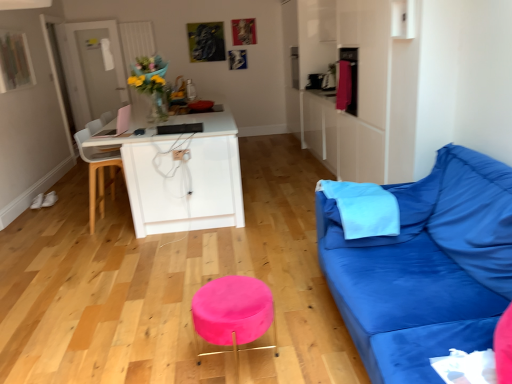
Question: Is the depth of white plastic chair at left less than that of light blue fabric pillow at right, arranged as the 1th pillow when viewed from the left?

Choices:
 (A) yes
 (B) no

Answer: (B)

Question: Can you confirm if white plastic chair at left is shorter than light blue fabric pillow at right, arranged as the 1th pillow when viewed from the left?

Choices:
 (A) no
 (B) yes

Answer: (A)

Question: Would you consider white plastic chair at left to be distant from light blue fabric pillow at right, the 2th pillow positioned from the right?

Choices:
 (A) no
 (B) yes

Answer: (B)

Question: Is white plastic chair at left facing away from light blue fabric pillow at right, the 2th pillow positioned from the right?

Choices:
 (A) no
 (B) yes

Answer: (A)

Question: Is white plastic chair at left directly adjacent to light blue fabric pillow at right, the 2th pillow positioned from the right?

Choices:
 (A) yes
 (B) no

Answer: (B)

Question: Is point (96, 177) closer or farther from the camera than point (463, 342)?

Choices:
 (A) farther
 (B) closer

Answer: (A)

Question: Considering their positions, is white plastic chair at left located in front of or behind blue fabric couch at right?

Choices:
 (A) front
 (B) behind

Answer: (B)

Question: Looking at the image, does white plastic chair at left seem bigger or smaller compared to blue fabric couch at right?

Choices:
 (A) big
 (B) small

Answer: (B)

Question: Do you think white plastic chair at left is within blue fabric couch at right, or outside of it?

Choices:
 (A) outside
 (B) inside

Answer: (A)

Question: Is blue fabric couch at right in front of or behind white plastic chair at left in the image?

Choices:
 (A) behind
 (B) front

Answer: (B)

Question: Is blue fabric couch at right bigger or smaller than white plastic chair at left?

Choices:
 (A) small
 (B) big

Answer: (B)

Question: In terms of width, does blue fabric couch at right look wider or thinner when compared to white plastic chair at left?

Choices:
 (A) thin
 (B) wide

Answer: (B)

Question: Is blue fabric couch at right inside the boundaries of white plastic chair at left, or outside?

Choices:
 (A) inside
 (B) outside

Answer: (B)

Question: Considering the positions of point (x=380, y=235) and point (x=256, y=291), is point (x=380, y=235) closer or farther from the camera than point (x=256, y=291)?

Choices:
 (A) farther
 (B) closer

Answer: (A)

Question: Is light blue fabric pillow at right, arranged as the 1th pillow when viewed from the left, wider or thinner than pink velvet stool at center?

Choices:
 (A) thin
 (B) wide

Answer: (B)